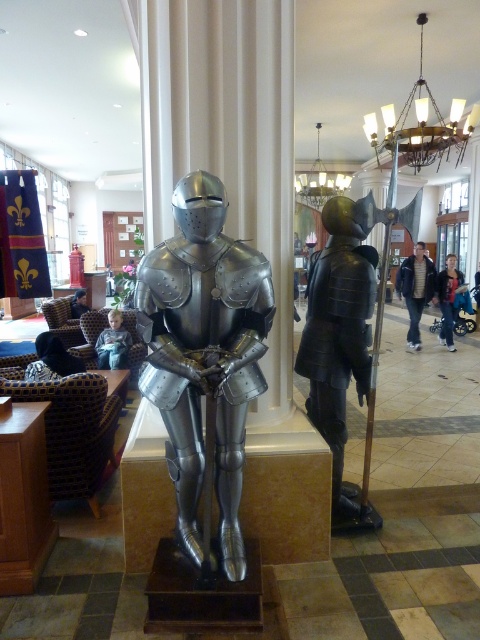
Question: Considering the relative positions of shiny black armor at center and dark blue jacket at center in the image provided, where is shiny black armor at center located with respect to dark blue jacket at center?

Choices:
 (A) right
 (B) left

Answer: (B)

Question: Does shiny black armor at center have a greater width compared to light brown leather jacket at center?

Choices:
 (A) no
 (B) yes

Answer: (B)

Question: Which point appears closest to the camera in this image?

Choices:
 (A) (456, 307)
 (B) (82, 298)

Answer: (B)

Question: Among these points, which one is nearest to the camera?

Choices:
 (A) (387, 148)
 (B) (417, 257)
 (C) (122, 344)
 (D) (225, 560)

Answer: (D)

Question: Does gold metallic chandelier at upper center have a larger size compared to light brown leather jacket at center?

Choices:
 (A) yes
 (B) no

Answer: (A)

Question: Which object is farther from the camera taking this photo?

Choices:
 (A) blue fabric couch at center
 (B) dark blue jacket at center
 (C) dark blue jeans at center

Answer: (C)